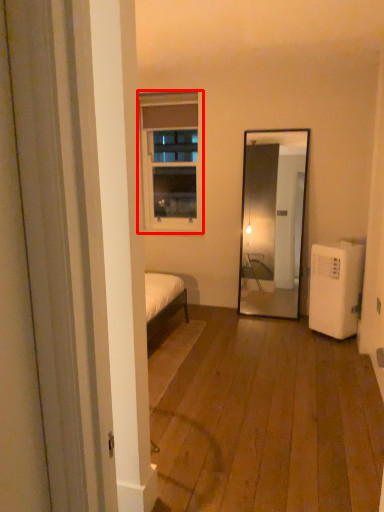
Question: From the image's perspective, what is the correct spatial relationship of window (annotated by the red box) in relation to air conditioner?

Choices:
 (A) above
 (B) below

Answer: (A)